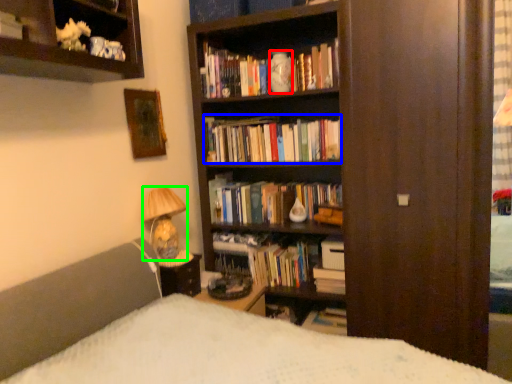
Question: Which object is the farthest from vase (highlighted by a red box)? Choose among these: book (highlighted by a blue box) or lamp (highlighted by a green box).

Choices:
 (A) book
 (B) lamp

Answer: (B)